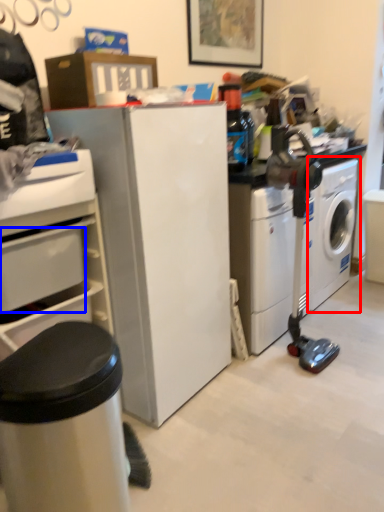
Question: Which object is further to the camera taking this photo, washing machine (highlighted by a red box) or drawer (highlighted by a blue box)?

Choices:
 (A) washing machine
 (B) drawer

Answer: (A)